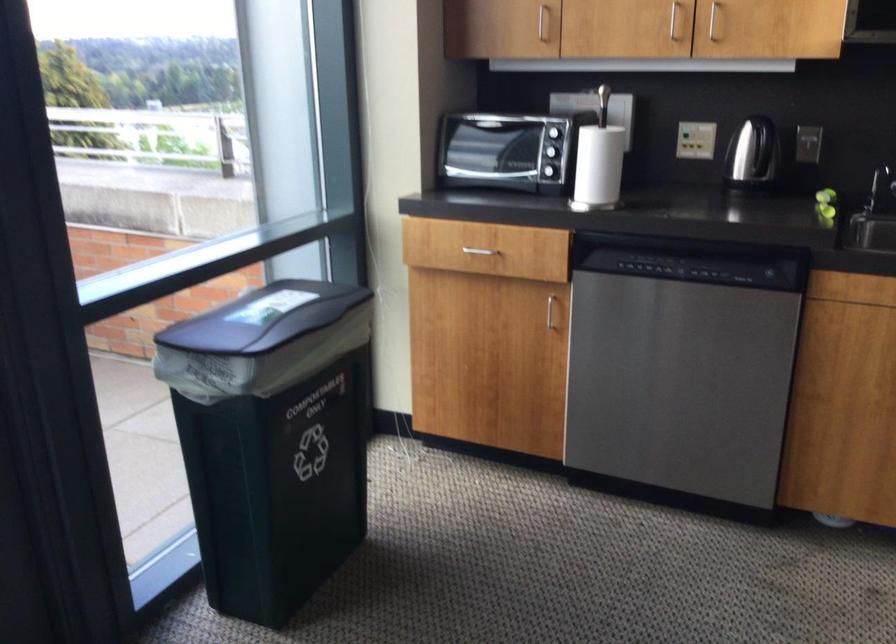
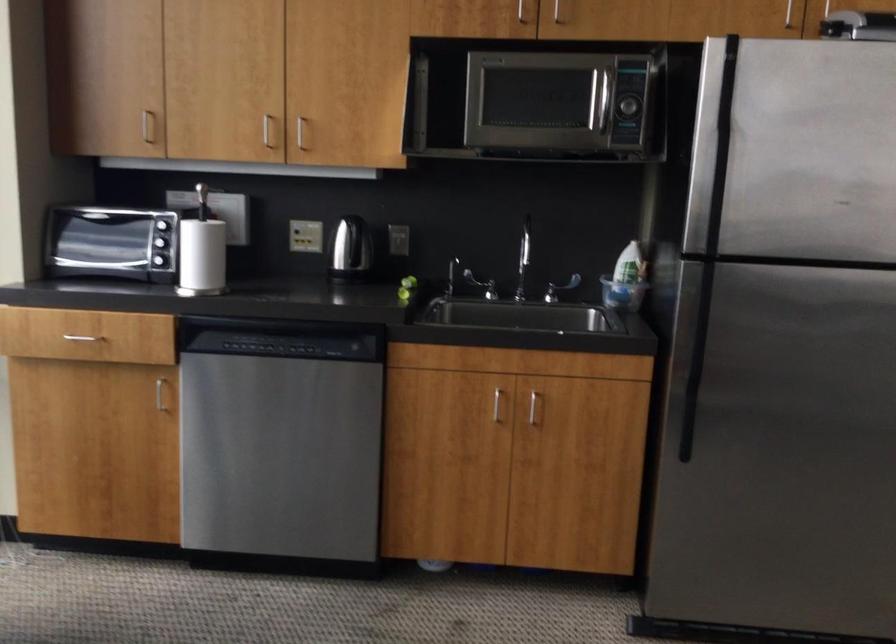
Question: What movement of the cameraman would produce the second image?

Choices:
 (A) Left
 (B) Right
 (C) Forward
 (D) Backward

Answer: (D)